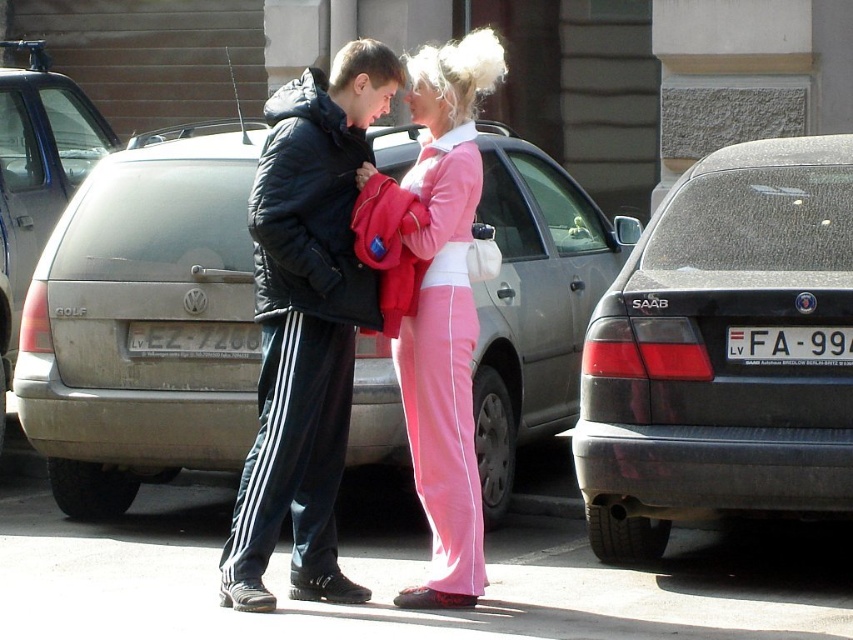
Which is more to the right, silver metallic hatchback at center or black puffy jacket at center?

black puffy jacket at center

Is silver metallic hatchback at center positioned in front of black puffy jacket at center?

That is False.

Which is in front, point (572, 355) or point (273, 168)?

Point (273, 168) is more forward.

Locate an element on the screen. silver metallic hatchback at center is located at coordinates (143, 324).

Is point (102, 460) more distant than point (747, 362)?

That is True.

In the scene shown: Which of these two, silver metallic hatchback at center or white plastic license plate at center, stands taller?

silver metallic hatchback at center

Is point (202, 211) more distant than point (813, 333)?

Yes, point (202, 211) is farther from viewer.

Locate an element on the screen. This screenshot has width=853, height=640. silver metallic hatchback at center is located at coordinates (143, 324).

Does dark gray car at right appear on the left side of white plastic license plate at center?

Incorrect, dark gray car at right is not on the left side of white plastic license plate at center.

Is dark gray car at right closer to the viewer compared to white plastic license plate at center?

Yes, it is.

Does point (813, 400) come farther from viewer compared to point (822, 342)?

That is True.

Find the location of `dark gray car at right`. dark gray car at right is located at coordinates (720, 353).